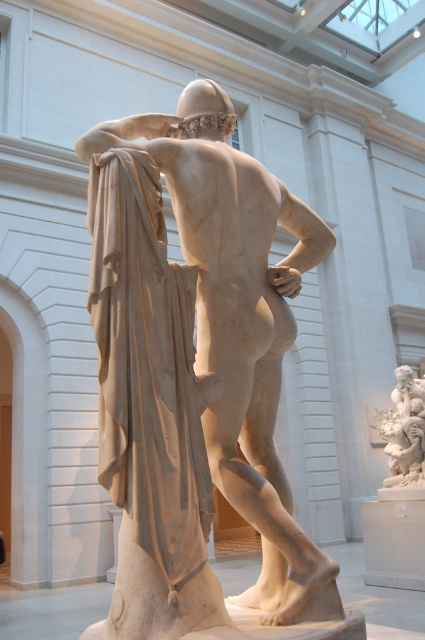
Does white marble statue at center appear on the left side of white marble cherub at right?

Correct, you'll find white marble statue at center to the left of white marble cherub at right.

Who is more forward, (x=186, y=195) or (x=419, y=480)?

Positioned in front is point (x=186, y=195).

Does point (274, 608) come closer to viewer compared to point (411, 461)?

Yes, point (274, 608) is closer to viewer.

This screenshot has height=640, width=425. Identify the location of white marble statue at center. (240, 323).